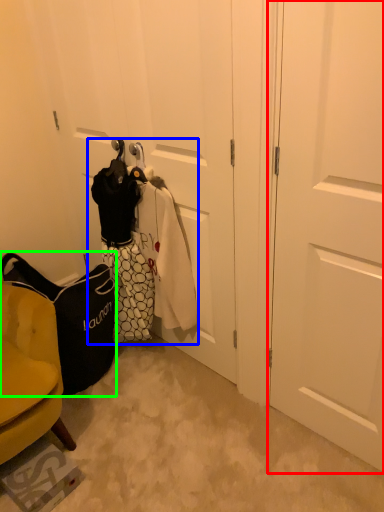
Question: Considering the real-world distances, which object is farthest from door (highlighted by a red box)? laundry (highlighted by a blue box) or handbag (highlighted by a green box)?

Choices:
 (A) laundry
 (B) handbag

Answer: (B)